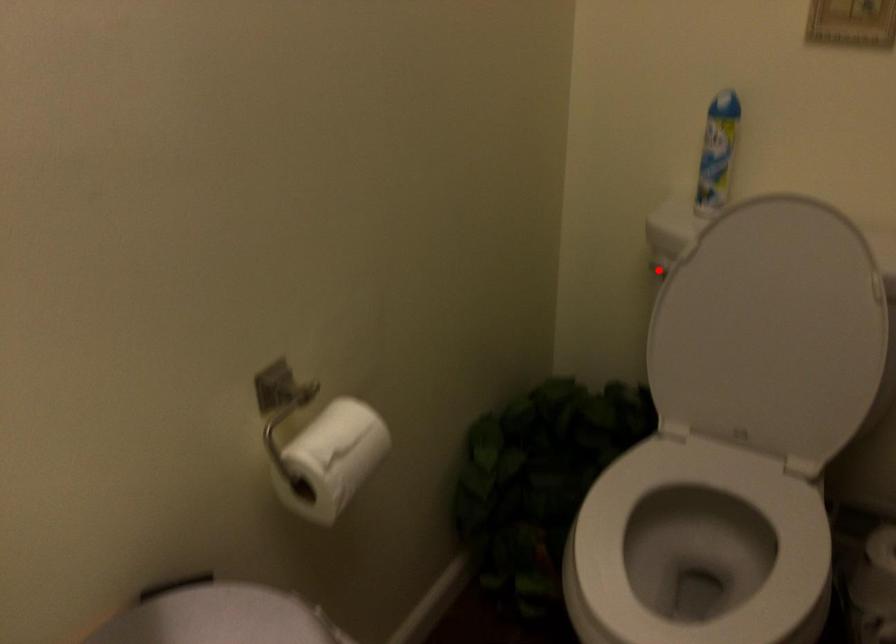
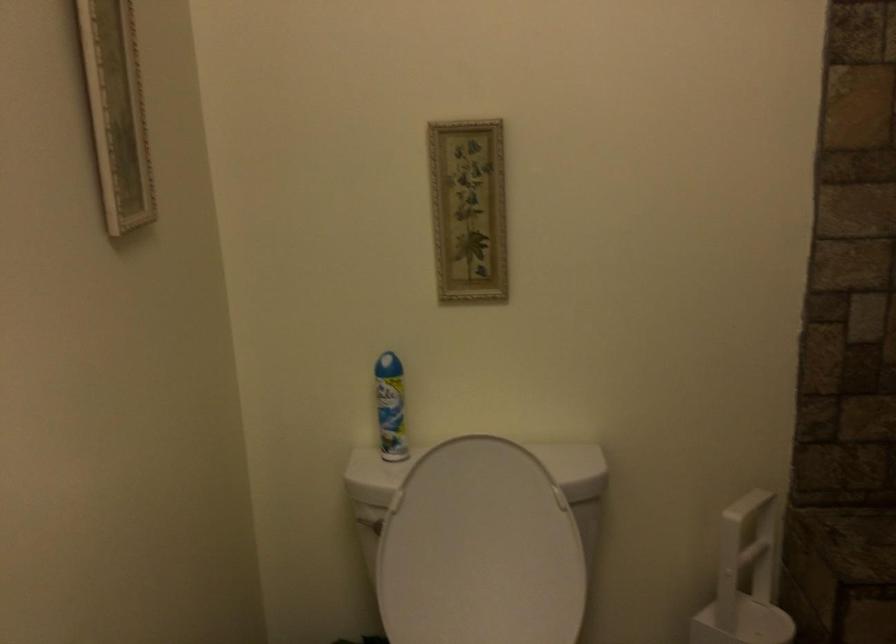
Locate, in the second image, the point that corresponds to the highlighted location in the first image.

(368, 522)